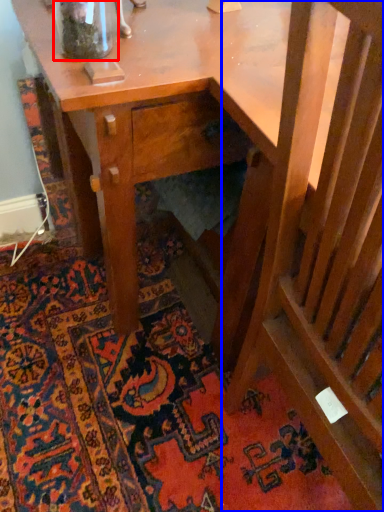
Question: Among these objects, which one is farthest to the camera, glass vase (highlighted by a red box) or rocking chair (highlighted by a blue box)?

Choices:
 (A) glass vase
 (B) rocking chair

Answer: (A)